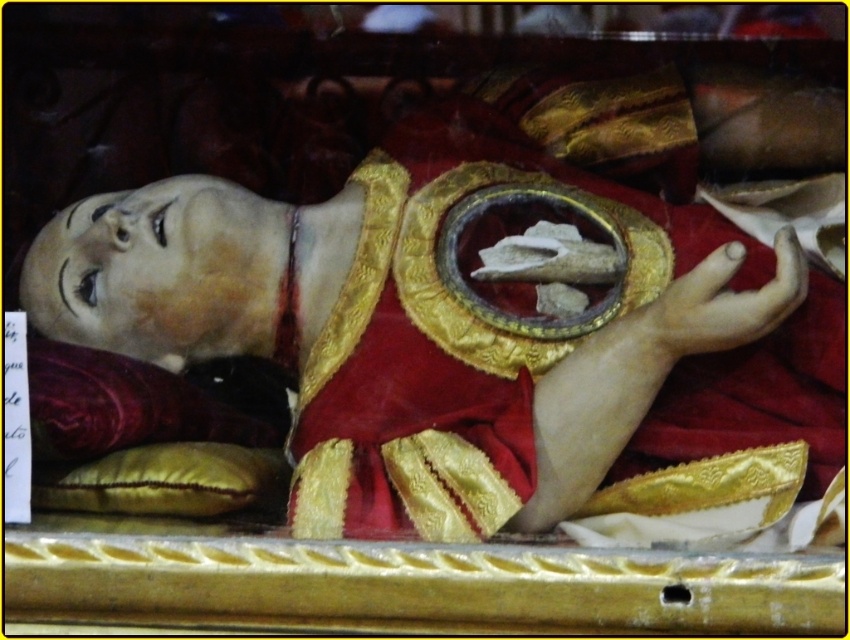
You are an interior designer tasked with arranging a display. You have a yellow fabric pillow at lower left and a matte gold hand at lower right. Based on the scene, which object is shorter in height?

The yellow fabric pillow at lower left is not as tall as the matte gold hand at lower right, so the yellow fabric pillow at lower left is shorter in height.

You are an interior designer arranging a solemn ceremony space. You need to place a golden statue on the velvet cushion at lower left and the yellow fabric pillow at lower left. Which object should you place the statue on to ensure it is closer to the front of the space?

The velvet cushion at lower left is further to the viewer than the yellow fabric pillow at lower left, so placing the golden statue on the velvet cushion at lower left will position it closer to the front of the space.

What is the object located at the coordinates point [469,316] in the image?

The point [469,316] marks the location of the matte gold statue at center.